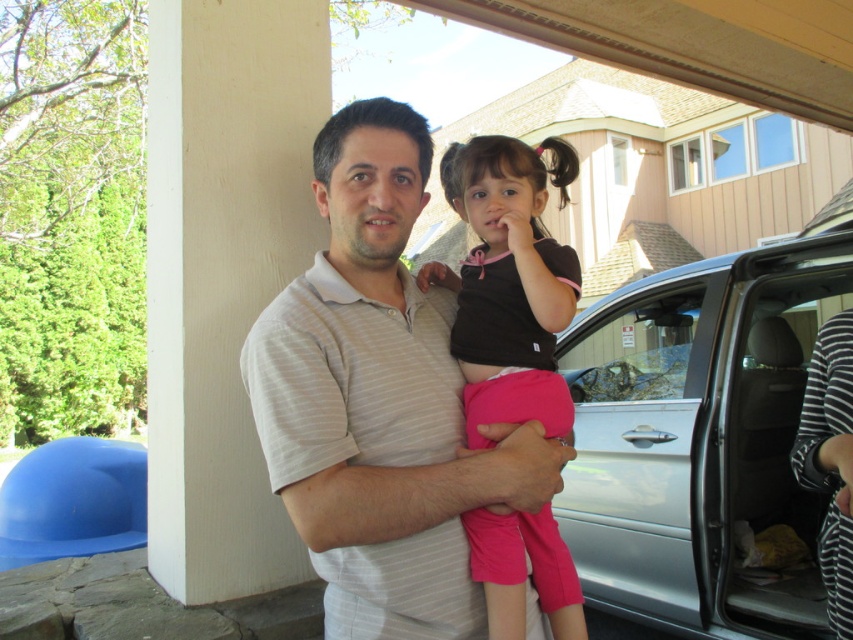
Is the position of striped cotton shirt at center less distant than that of black matte shirt at center?

Yes.

This screenshot has height=640, width=853. Describe the element at coordinates (380, 401) in the screenshot. I see `striped cotton shirt at center` at that location.

Which is in front, point (335, 454) or point (521, 419)?

Point (335, 454) is more forward.

The width and height of the screenshot is (853, 640). I want to click on striped cotton shirt at center, so click(380, 401).

Locate an element on the screen. This screenshot has width=853, height=640. silver metallic car at right is located at coordinates (703, 436).

Can you confirm if silver metallic car at right is wider than black matte shirt at center?

Correct, the width of silver metallic car at right exceeds that of black matte shirt at center.

Which is behind, point (596, 502) or point (498, 333)?

The point (596, 502) is more distant.

You are a GUI agent. You are given a task and a screenshot of the screen. Output one action in this format:
    pyautogui.click(x=<x>, y=<y>)
    Task: Click on the silver metallic car at right
    The width and height of the screenshot is (853, 640).
    Given the screenshot: What is the action you would take?
    pyautogui.click(x=703, y=436)

How distant is silver metallic car at right from striped cotton shirt at center?

silver metallic car at right and striped cotton shirt at center are 2.52 meters apart.

Which is in front, point (660, 420) or point (364, 99)?

Positioned in front is point (364, 99).

What do you see at coordinates (703, 436) in the screenshot? Image resolution: width=853 pixels, height=640 pixels. I see `silver metallic car at right` at bounding box center [703, 436].

Image resolution: width=853 pixels, height=640 pixels. Find the location of `silver metallic car at right`. silver metallic car at right is located at coordinates (703, 436).